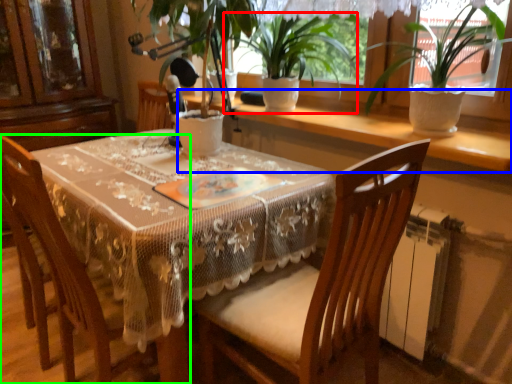
Question: Based on their relative distances, which object is farther from houseplant (highlighted by a red box)? Choose from window sill (highlighted by a blue box) and chair (highlighted by a green box).

Choices:
 (A) window sill
 (B) chair

Answer: (B)